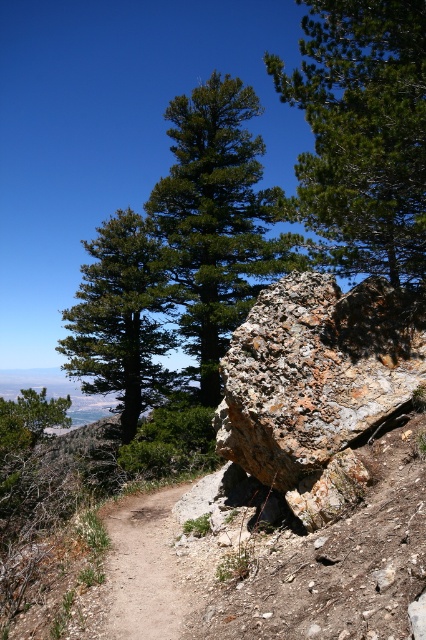
Question: Can you confirm if green matte tree at center is positioned above green matte tree at upper left?

Choices:
 (A) yes
 (B) no

Answer: (A)

Question: Is the position of green leafy tree at center more distant than that of brown dirt track at center?

Choices:
 (A) yes
 (B) no

Answer: (A)

Question: Is green matte tree at center above brown dirt track at center?

Choices:
 (A) yes
 (B) no

Answer: (A)

Question: Which point is closer to the camera taking this photo?

Choices:
 (A) (308, 72)
 (B) (126, 381)
 (C) (164, 625)

Answer: (C)

Question: Which of the following is the farthest from the observer?

Choices:
 (A) (394, 240)
 (B) (157, 561)
 (C) (60, 408)

Answer: (C)

Question: Which of the following is the closest to the observer?

Choices:
 (A) (100, 301)
 (B) (256, 134)

Answer: (A)